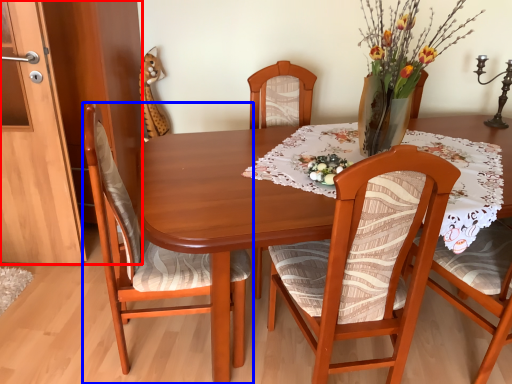
Question: Which of the following is the closest to the observer, cabinetry (highlighted by a red box) or chair (highlighted by a blue box)?

Choices:
 (A) cabinetry
 (B) chair

Answer: (B)